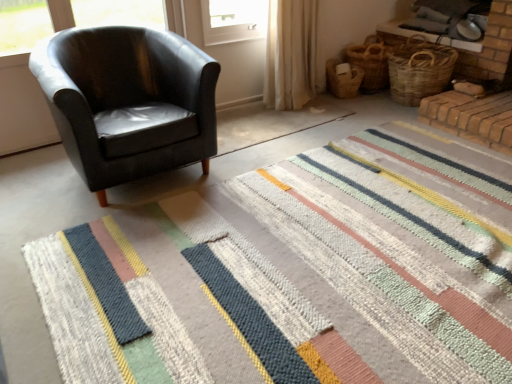
Locate an element on the screen. The width and height of the screenshot is (512, 384). woven straw basket at right, which is counted as the 1th basket, starting from the left is located at coordinates (343, 79).

Measure the distance between beige fabric curtain at upper center and camera.

A distance of 9.42 feet exists between beige fabric curtain at upper center and camera.

In order to face matte black armchair at left, should I rotate leftwards or rightwards?

Rotate your view left by about 16.569°.

Identify the location of woven straw basket at right, which is counted as the 1th basket, starting from the left. (343, 79).

Who is taller, striped woolen rug at center or woven brown basket at upper right, arranged as the 2th basket when viewed from the left?

Standing taller between the two is woven brown basket at upper right, arranged as the 2th basket when viewed from the left.

Is the depth of striped woolen rug at center greater than that of woven brown basket at upper right, acting as the second basket starting from the right?

No, it is in front of woven brown basket at upper right, acting as the second basket starting from the right.

In the image, there is a woven brown basket at upper right, arranged as the 2th basket when viewed from the left. What are the coordinates of `doormat below it (from a real-world perspective)` in the screenshot? It's located at (300, 275).

Image resolution: width=512 pixels, height=384 pixels. Find the location of `chair that appears on the left of woven brown basket at upper right, the 1th basket in the right-to-left sequence`. chair that appears on the left of woven brown basket at upper right, the 1th basket in the right-to-left sequence is located at coordinates (128, 101).

Is woven brown basket at upper right, the 1th basket in the right-to-left sequence, at the right side of matte black armchair at left?

Yes.

Would you say woven brown basket at upper right, marked as the third basket in a left-to-right arrangement, contains matte black armchair at left?

No, matte black armchair at left is not inside woven brown basket at upper right, marked as the third basket in a left-to-right arrangement.

What's the angular difference between woven brown basket at upper right, the 1th basket in the right-to-left sequence, and matte black armchair at left's facing directions?

The angular difference between woven brown basket at upper right, the 1th basket in the right-to-left sequence, and matte black armchair at left is 86.8 degrees.

Which object is closer to the camera taking this photo, beige fabric curtain at upper center or striped woolen rug at center?

Positioned in front is striped woolen rug at center.

Is the surface of beige fabric curtain at upper center in direct contact with striped woolen rug at center?

There is a gap between beige fabric curtain at upper center and striped woolen rug at center.

Can you confirm if beige fabric curtain at upper center is positioned to the left of striped woolen rug at center?

Indeed, beige fabric curtain at upper center is positioned on the left side of striped woolen rug at center.

Where is `doormat below the beige fabric curtain at upper center (from a real-world perspective)`? doormat below the beige fabric curtain at upper center (from a real-world perspective) is located at coordinates (300, 275).

Is striped woolen rug at center thinner than woven brown basket at upper right, marked as the third basket in a left-to-right arrangement?

Incorrect, the width of striped woolen rug at center is not less than that of woven brown basket at upper right, marked as the third basket in a left-to-right arrangement.

Considering the relative positions of striped woolen rug at center and woven brown basket at upper right, marked as the third basket in a left-to-right arrangement, in the image provided, is striped woolen rug at center in front of woven brown basket at upper right, marked as the third basket in a left-to-right arrangement,?

That is True.

Is striped woolen rug at center bigger or smaller than woven brown basket at upper right, the 1th basket in the right-to-left sequence?

In the image, striped woolen rug at center appears to be larger than woven brown basket at upper right, the 1th basket in the right-to-left sequence.

Considering the positions of objects woven straw basket at right, acting as the third basket starting from the right, and woven brown basket at upper right, marked as the third basket in a left-to-right arrangement, in the image provided, who is in front, woven straw basket at right, acting as the third basket starting from the right, or woven brown basket at upper right, marked as the third basket in a left-to-right arrangement,?

woven brown basket at upper right, marked as the third basket in a left-to-right arrangement, is more forward.

Between point (346, 79) and point (410, 55), which one is positioned in front?

Point (410, 55)

Does woven straw basket at right, which is counted as the 1th basket, starting from the left, have a lesser width compared to woven brown basket at upper right, marked as the third basket in a left-to-right arrangement?

Yes, woven straw basket at right, which is counted as the 1th basket, starting from the left, is thinner than woven brown basket at upper right, marked as the third basket in a left-to-right arrangement.

Does woven brown basket at upper right, the 1th basket in the right-to-left sequence, have a lesser height compared to woven brown basket at upper right, arranged as the 2th basket when viewed from the left?

In fact, woven brown basket at upper right, the 1th basket in the right-to-left sequence, may be taller than woven brown basket at upper right, arranged as the 2th basket when viewed from the left.

In the scene shown: Considering the relative positions of woven brown basket at upper right, marked as the third basket in a left-to-right arrangement, and woven brown basket at upper right, arranged as the 2th basket when viewed from the left, in the image provided, is woven brown basket at upper right, marked as the third basket in a left-to-right arrangement, behind woven brown basket at upper right, arranged as the 2th basket when viewed from the left,?

No, the depth of woven brown basket at upper right, marked as the third basket in a left-to-right arrangement, is less than that of woven brown basket at upper right, arranged as the 2th basket when viewed from the left.

Which is closer, (372, 66) or (383, 88)?

Point (372, 66) appears to be closer to the viewer than point (383, 88).

Is woven straw basket at right, acting as the third basket starting from the right, far from beige fabric curtain at upper center?

No, woven straw basket at right, acting as the third basket starting from the right, is in close proximity to beige fabric curtain at upper center.

From a real-world perspective, who is located higher, woven straw basket at right, acting as the third basket starting from the right, or beige fabric curtain at upper center?

From a 3D spatial view, beige fabric curtain at upper center is above.

Considering the positions of point (348, 79) and point (315, 13), is point (348, 79) closer or farther from the camera than point (315, 13)?

Clearly, point (348, 79) is more distant from the camera than point (315, 13).

Which basket is the 3rd one when counting from the back of the striped woolen rug at center? Please provide its 2D coordinates.

[(370, 63)]

Locate an element on the screen. The image size is (512, 384). chair above the woven brown basket at upper right, the 1th basket in the right-to-left sequence (from a real-world perspective) is located at coordinates (128, 101).

Estimate the real-world distances between objects in this image. Which object is closer to matte black armchair at left, woven brown basket at upper right, the 1th basket in the right-to-left sequence, or woven straw basket at right, acting as the third basket starting from the right?

Based on the image, woven brown basket at upper right, the 1th basket in the right-to-left sequence, appears to be nearer to matte black armchair at left.

Considering their positions, is woven straw basket at right, which is counted as the 1th basket, starting from the left, positioned further to matte black armchair at left than woven brown basket at upper right, arranged as the 2th basket when viewed from the left?

woven brown basket at upper right, arranged as the 2th basket when viewed from the left.

Which object lies further to the anchor point woven brown basket at upper right, acting as the second basket starting from the right, woven straw basket at right, which is counted as the 1th basket, starting from the left, or beige fabric curtain at upper center?

beige fabric curtain at upper center is positioned further to the anchor woven brown basket at upper right, acting as the second basket starting from the right.

From the image, which object appears to be nearer to woven brown basket at upper right, marked as the third basket in a left-to-right arrangement, striped woolen rug at center or beige fabric curtain at upper center?

beige fabric curtain at upper center lies closer to woven brown basket at upper right, marked as the third basket in a left-to-right arrangement, than the other object.

Which object lies further to the anchor point woven brown basket at upper right, arranged as the 2th basket when viewed from the left, matte black armchair at left or woven straw basket at right, which is counted as the 1th basket, starting from the left?

The object further to woven brown basket at upper right, arranged as the 2th basket when viewed from the left, is matte black armchair at left.

Looking at the image, which one is located further to striped woolen rug at center, woven brown basket at upper right, marked as the third basket in a left-to-right arrangement, or woven straw basket at right, acting as the third basket starting from the right?

Based on the image, woven straw basket at right, acting as the third basket starting from the right, appears to be further to striped woolen rug at center.

From the picture: Estimate the real-world distances between objects in this image. Which object is closer to woven brown basket at upper right, arranged as the 2th basket when viewed from the left, striped woolen rug at center or matte black armchair at left?

matte black armchair at left is positioned closer to the anchor woven brown basket at upper right, arranged as the 2th basket when viewed from the left.

From the picture: From the image, which object appears to be nearer to woven straw basket at right, which is counted as the 1th basket, starting from the left, striped woolen rug at center or woven brown basket at upper right, arranged as the 2th basket when viewed from the left?

Based on the image, woven brown basket at upper right, arranged as the 2th basket when viewed from the left, appears to be nearer to woven straw basket at right, which is counted as the 1th basket, starting from the left.

Locate an element on the screen. The width and height of the screenshot is (512, 384). chair between striped woolen rug at center and beige fabric curtain at upper center from front to back is located at coordinates (128, 101).

This screenshot has width=512, height=384. What are the coordinates of `curtain between matte black armchair at left and woven brown basket at upper right, the 1th basket in the right-to-left sequence, from left to right` in the screenshot? It's located at (290, 54).

Locate an element on the screen. This screenshot has width=512, height=384. chair located between striped woolen rug at center and woven straw basket at right, acting as the third basket starting from the right, in the depth direction is located at coordinates (128, 101).

This screenshot has width=512, height=384. Identify the location of chair between striped woolen rug at center and woven brown basket at upper right, marked as the third basket in a left-to-right arrangement, along the z-axis. (128, 101).